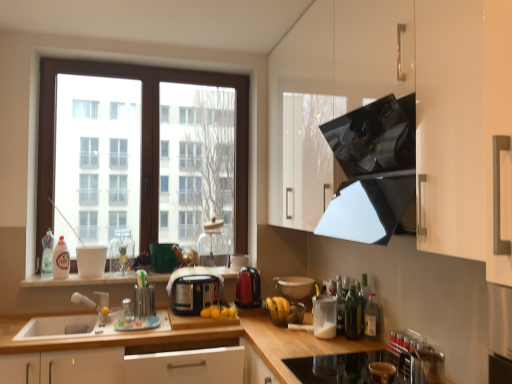
At what (x,y) coordinates should I click in order to perform the action: click on vacant area that is in front of translucent plastic bottle at center, the third bottle positioned from the front. Please return your answer as a coordinate pair (x, y). The image size is (512, 384). Looking at the image, I should click on (339, 343).